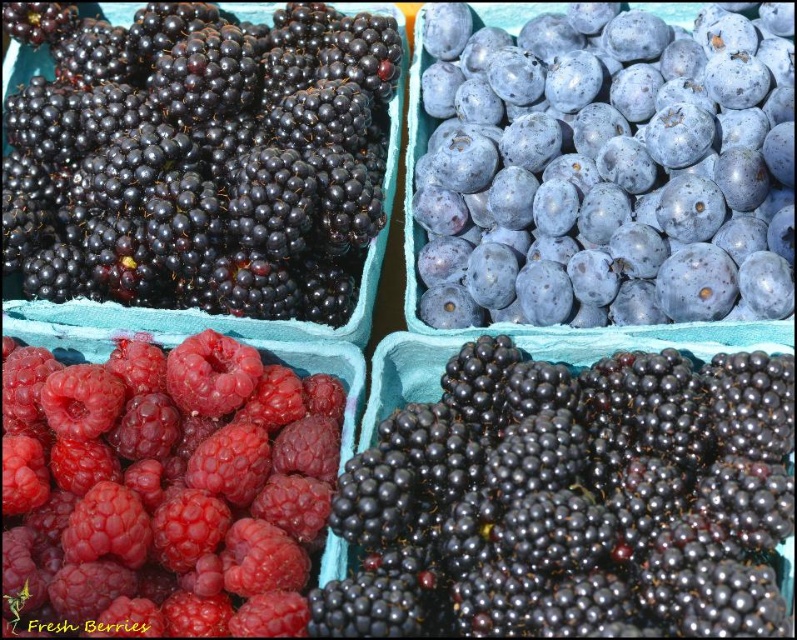
Question: Which object is the closest to the blue matte blueberry at upper right?

Choices:
 (A) shiny black grapes at center
 (B) shiny black berries at upper left
 (C) glossy red raspberry at lower left

Answer: (A)

Question: Considering the relative positions of glossy red raspberry at lower left and shiny black berries at upper left in the image provided, where is glossy red raspberry at lower left located with respect to shiny black berries at upper left?

Choices:
 (A) above
 (B) below

Answer: (B)

Question: In this image, where is glossy red raspberry at lower left located relative to shiny black berries at upper left?

Choices:
 (A) below
 (B) above

Answer: (A)

Question: Which point is farther from the camera taking this photo?

Choices:
 (A) (432, 435)
 (B) (548, 125)

Answer: (B)

Question: Does glossy red raspberry at lower left have a greater width compared to shiny black berries at upper left?

Choices:
 (A) yes
 (B) no

Answer: (B)

Question: Among these points, which one is farthest from the camera?

Choices:
 (A) (684, 198)
 (B) (61, 96)
 (C) (576, 529)
 (D) (234, 392)

Answer: (B)